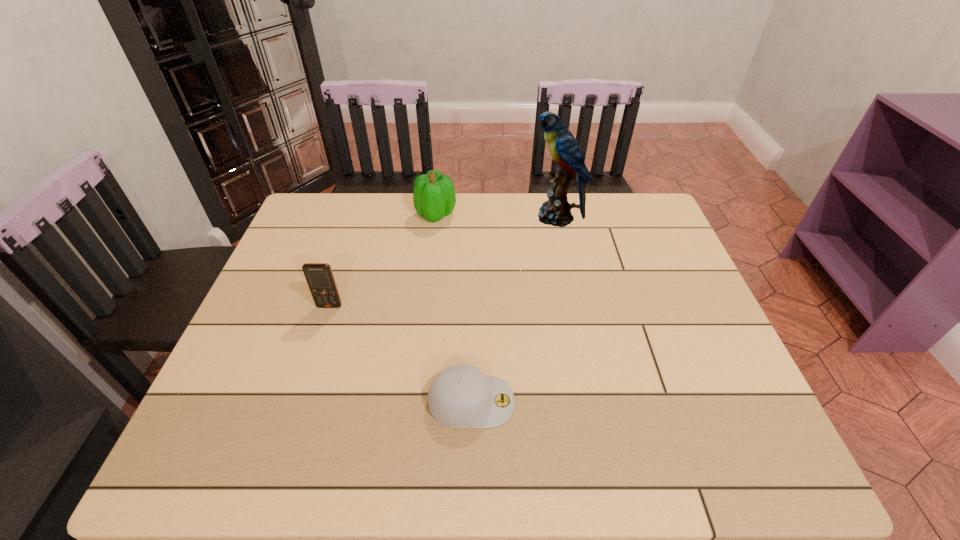
Find the location of a particular element. The height and width of the screenshot is (540, 960). vacant space situated 0.270m on the front of the bell pepper is located at coordinates (427, 289).

Find the location of a particular element. vacant space located 0.310m on the screen of the cellular telephone is located at coordinates (291, 423).

Locate an element on the screen. vacant space located 0.260m on the front-facing side of the nearest object is located at coordinates (638, 401).

Where is `parrot situated at the far edge`? This screenshot has width=960, height=540. parrot situated at the far edge is located at coordinates (564, 149).

In order to click on bell pepper at the far edge in this screenshot , I will do `click(434, 197)`.

This screenshot has height=540, width=960. Find the location of `object that is at the near edge`. object that is at the near edge is located at coordinates (461, 396).

Locate an element on the screen. This screenshot has height=540, width=960. object that is at the left edge is located at coordinates (319, 276).

I want to click on vacant space at the far edge of the desktop, so (572, 210).

At what (x,y) coordinates should I click in order to perform the action: click on vacant space at the left edge of the desktop. Please return your answer as a coordinate pair (x, y). This screenshot has height=540, width=960. Looking at the image, I should click on (249, 417).

The image size is (960, 540). In the image, there is a desktop. In order to click on vacant space at the right edge in this screenshot , I will do click(x=708, y=371).